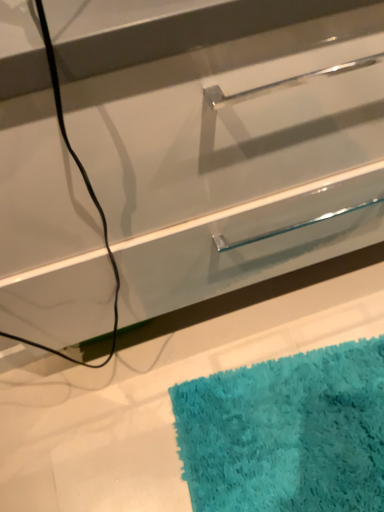
Where is `free point above turquoise shaggy bath mat at lower right (from a real-world perspective)`? free point above turquoise shaggy bath mat at lower right (from a real-world perspective) is located at coordinates (298, 425).